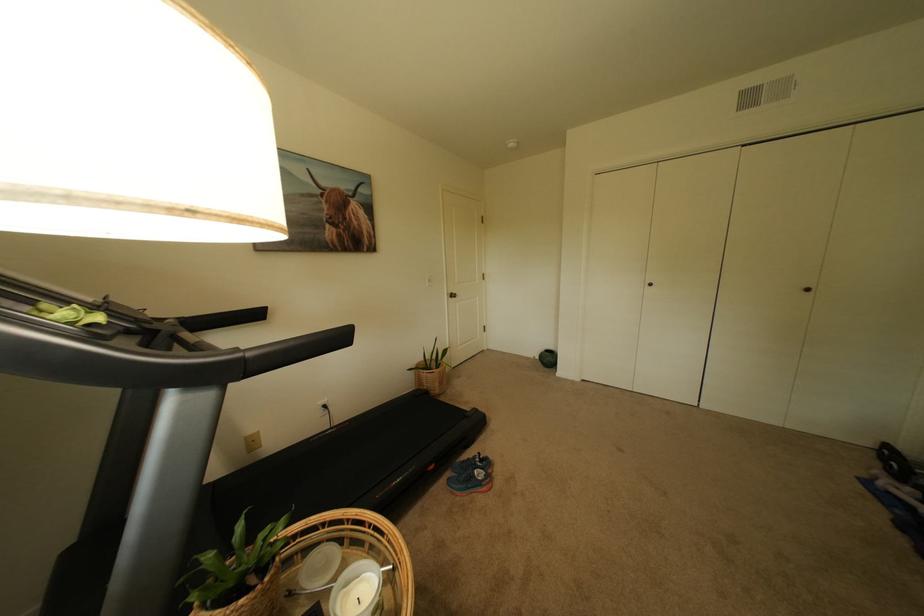
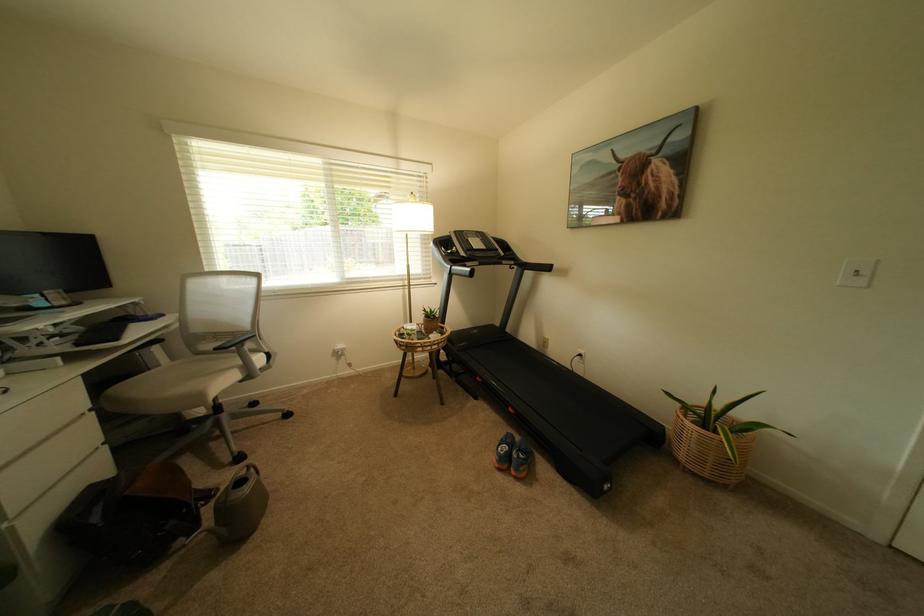
Find the pixel in the second image that matches the point at 446,385 in the first image.

(695, 448)